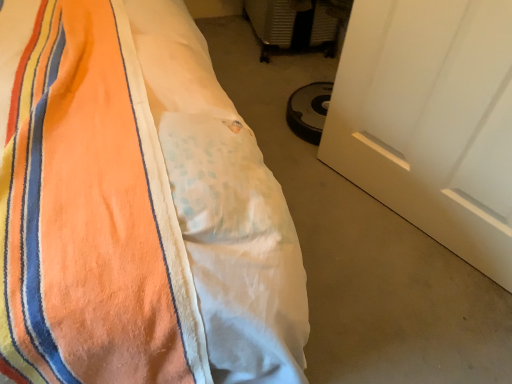
Where is `free spot in front of white matte door at lower right`? The image size is (512, 384). free spot in front of white matte door at lower right is located at coordinates (403, 299).